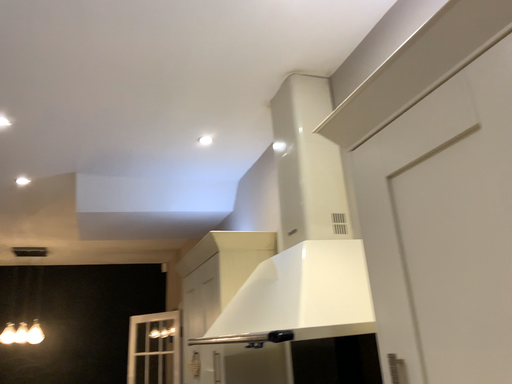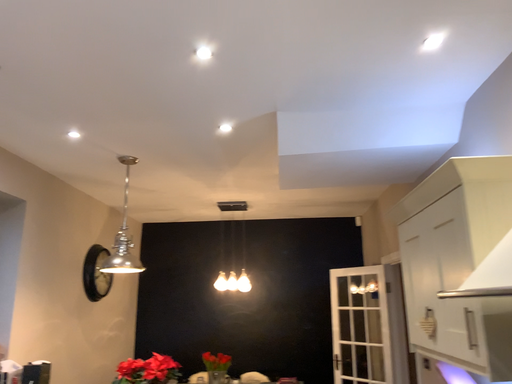
Question: How did the camera likely rotate when shooting the video?

Choices:
 (A) rotated right
 (B) rotated left

Answer: (B)